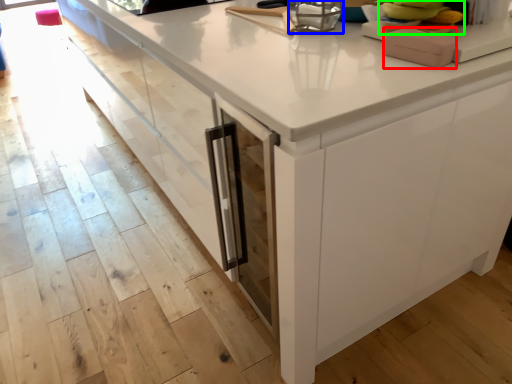
Question: Based on their relative distances, which object is farther from appliance (highlighted by a red box)? Choose from appliance (highlighted by a blue box) and food (highlighted by a green box).

Choices:
 (A) appliance
 (B) food

Answer: (A)